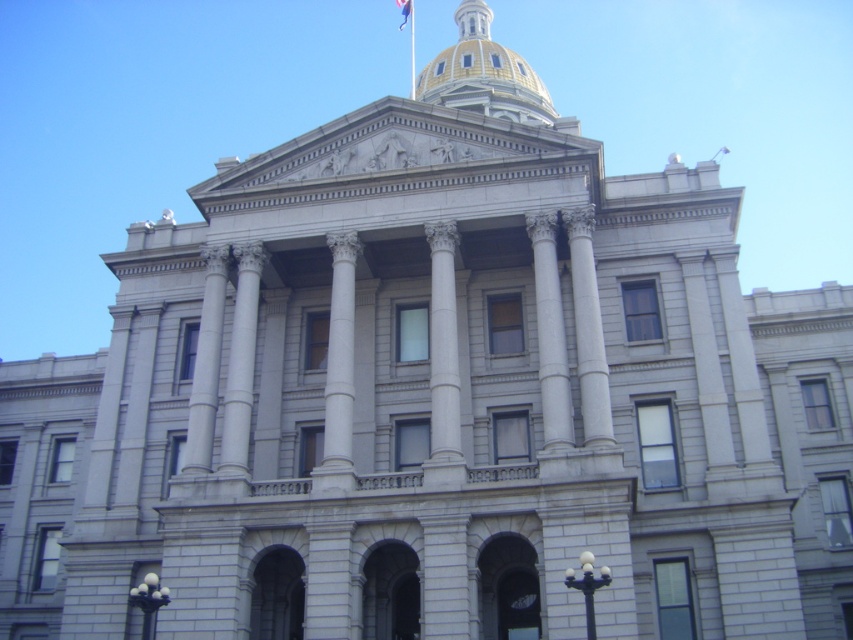
Based on the photo, you are standing in front of the grand neoclassical building and notice two points marked on the facade. The first point is at coordinate point (x=413, y=32) and the second is at point (x=409, y=0). If you were to walk towards the building, which point would appear closer to you as you approach?

Point (x=413, y=32) is closer to the camera than point (x=409, y=0), so as you approach the building, the point (x=413, y=32) will continue to appear closer to you.